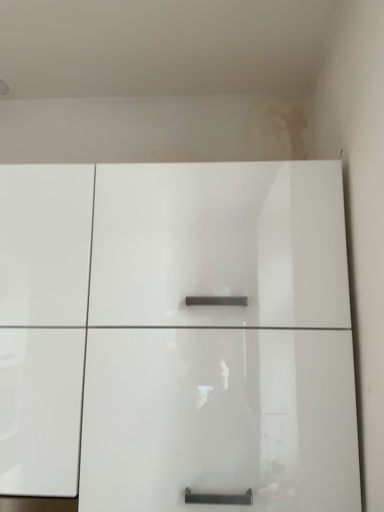
What is the approximate height of glossy white cupboard at center?

glossy white cupboard at center is 31.49 inches in height.

Locate an element on the screen. The image size is (384, 512). glossy white cupboard at center is located at coordinates pos(177,336).

Describe the element at coordinates (177, 336) in the screenshot. I see `glossy white cupboard at center` at that location.

Measure the distance between glossy white cupboard at center and camera.

glossy white cupboard at center is 88.10 centimeters away from camera.

In order to face glossy white cupboard at center, should I rotate leftwards or rightwards?

Rotate left and turn 7.587 degrees.

I want to click on glossy white cupboard at center, so click(x=177, y=336).